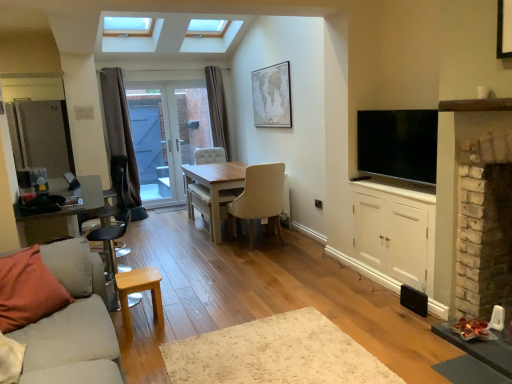
Question: Should I look upward or downward to see beige textured map at upper center?

Choices:
 (A) up
 (B) down

Answer: (A)

Question: Can you confirm if metallic silver barstool at left, acting as the 2th armchair starting from the back, is taller than white wood cabinet at right?

Choices:
 (A) yes
 (B) no

Answer: (B)

Question: Is metallic silver barstool at left, acting as the 2th armchair starting from the back, closer to camera compared to white wood cabinet at right?

Choices:
 (A) yes
 (B) no

Answer: (B)

Question: Is metallic silver barstool at left, which is the first armchair in front-to-back order, at the left side of white wood cabinet at right?

Choices:
 (A) no
 (B) yes

Answer: (B)

Question: From a real-world perspective, does metallic silver barstool at left, the 1th armchair from the right, stand above white wood cabinet at right?

Choices:
 (A) yes
 (B) no

Answer: (B)

Question: Does metallic silver barstool at left, acting as the 2th armchair starting from the back, have a greater width compared to white wood cabinet at right?

Choices:
 (A) yes
 (B) no

Answer: (B)

Question: Does metallic silver barstool at left, which is the first armchair in front-to-back order, have a lesser width compared to white wood cabinet at right?

Choices:
 (A) no
 (B) yes

Answer: (B)

Question: Is metallic silver barstool at left, which is counted as the 2th armchair, starting from the left, touching white glossy door at center?

Choices:
 (A) no
 (B) yes

Answer: (A)

Question: Considering the relative sizes of metallic silver barstool at left, the 1th armchair from the right, and white glossy door at center in the image provided, is metallic silver barstool at left, the 1th armchair from the right, shorter than white glossy door at center?

Choices:
 (A) no
 (B) yes

Answer: (B)

Question: From a real-world perspective, is metallic silver barstool at left, the 1th armchair from the right, beneath white glossy door at center?

Choices:
 (A) yes
 (B) no

Answer: (A)

Question: Considering the relative sizes of metallic silver barstool at left, which is the first armchair in front-to-back order, and white glossy door at center in the image provided, is metallic silver barstool at left, which is the first armchair in front-to-back order, thinner than white glossy door at center?

Choices:
 (A) yes
 (B) no

Answer: (B)

Question: From the image's perspective, does metallic silver barstool at left, acting as the 2th armchair starting from the back, appear lower than white glossy door at center?

Choices:
 (A) yes
 (B) no

Answer: (A)

Question: Considering the relative positions of metallic silver barstool at left, the 1th armchair from the right, and white glossy door at center in the image provided, is metallic silver barstool at left, the 1th armchair from the right, to the right of white glossy door at center from the viewer's perspective?

Choices:
 (A) yes
 (B) no

Answer: (A)

Question: Is light wood stool at lower left located within flat screen tv at right?

Choices:
 (A) yes
 (B) no

Answer: (B)